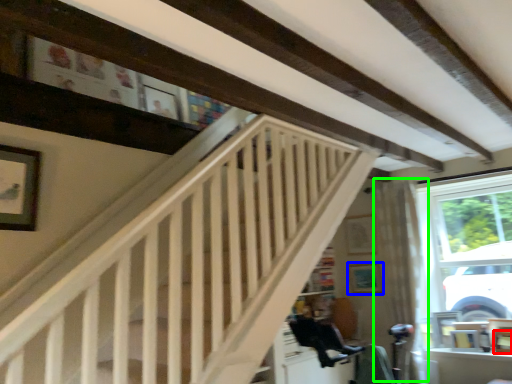
Question: Based on their relative distances, which object is farther from picture frame (highlighted by a red box)? Choose from picture frame (highlighted by a blue box) and curtain (highlighted by a green box).

Choices:
 (A) picture frame
 (B) curtain

Answer: (A)